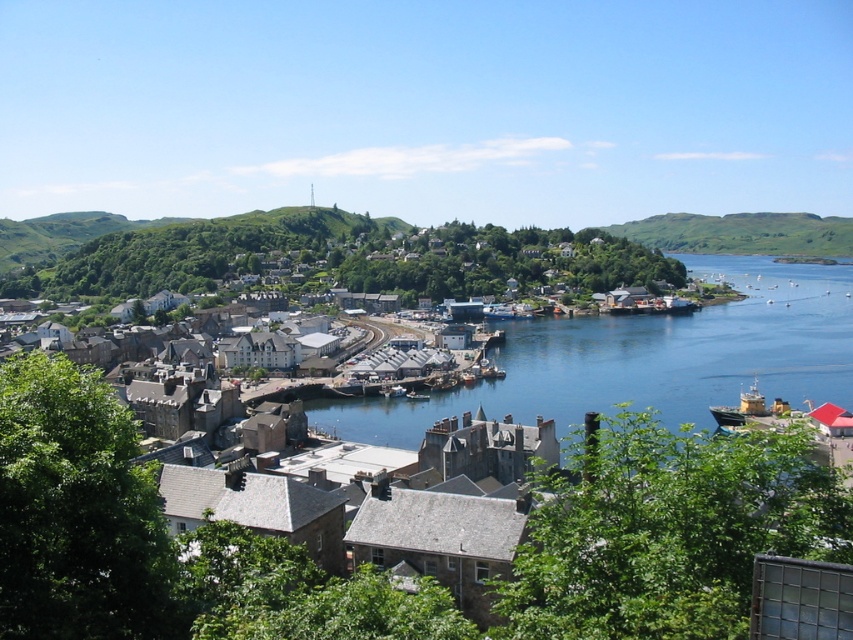
Question: Which point is closer to the camera?

Choices:
 (A) (167, 236)
 (B) (776, 310)

Answer: (B)

Question: Can you confirm if blue water at center is bigger than green grassy hill at right?

Choices:
 (A) yes
 (B) no

Answer: (A)

Question: Considering the relative positions of blue water at center and green grassy hill at right in the image provided, where is blue water at center located with respect to green grassy hill at right?

Choices:
 (A) left
 (B) right

Answer: (A)

Question: Based on their relative distances, which object is nearer to the green grassy hill at right?

Choices:
 (A) green grassy hill at upper left
 (B) blue water at center

Answer: (B)

Question: Which object appears farthest from the camera in this image?

Choices:
 (A) green grassy hill at upper left
 (B) blue water at center
 (C) green grassy hill at right

Answer: (C)

Question: Does green grassy hill at upper left appear under green grassy hill at right?

Choices:
 (A) no
 (B) yes

Answer: (B)